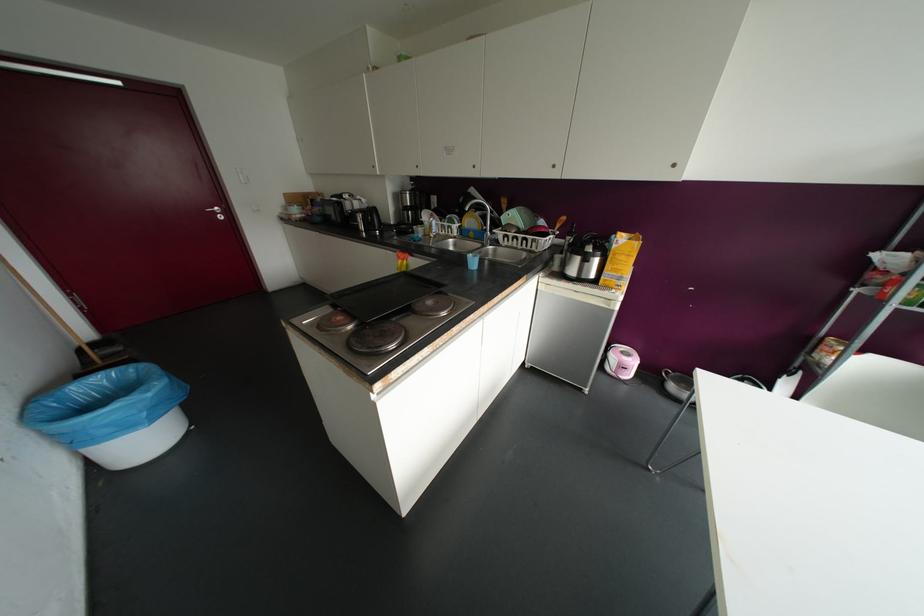
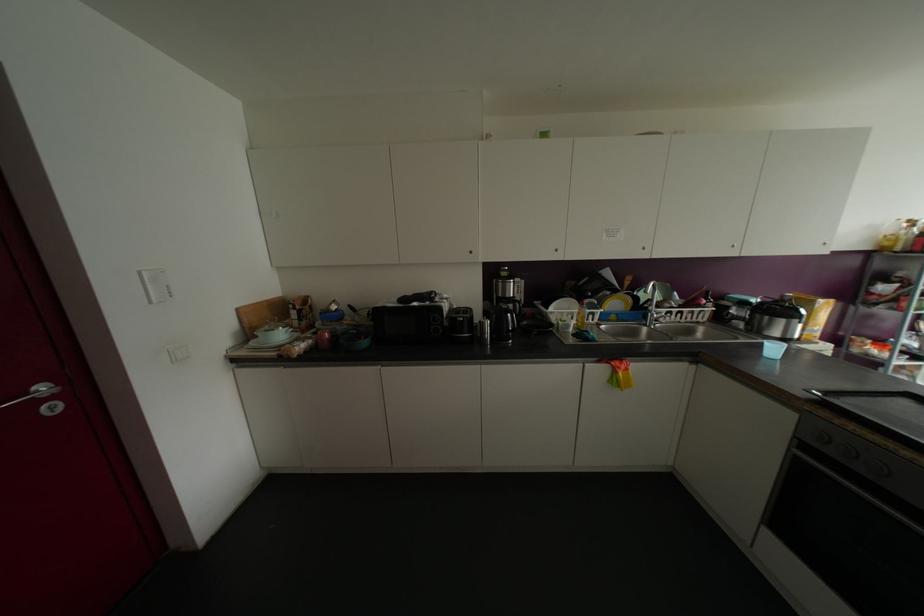
Where in the second image is the point corresponding to pixel 514 245 from the first image?

(677, 318)